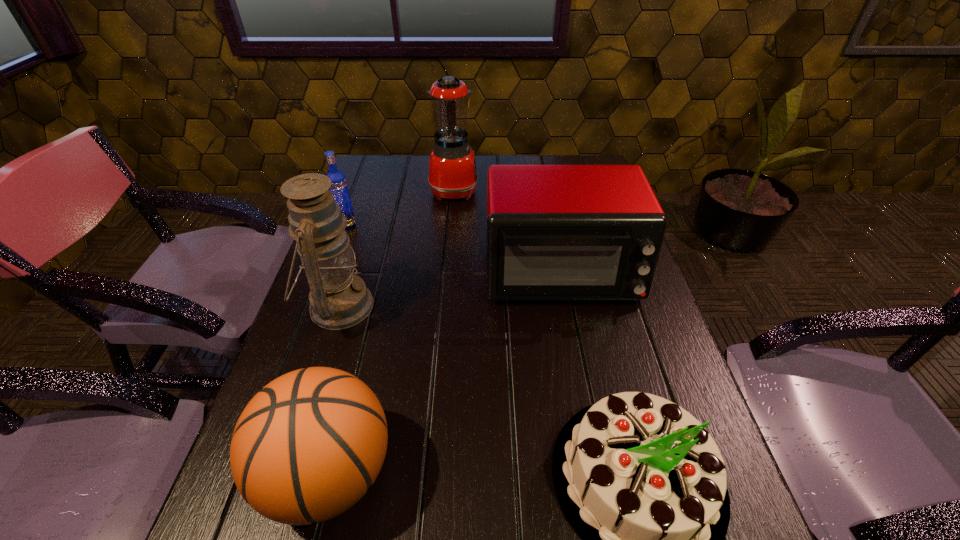
The width and height of the screenshot is (960, 540). Identify the location of vodka that is positioned at the left edge. (339, 188).

At what (x,y) coordinates should I click in order to perform the action: click on object present at the right edge. Please return your answer as a coordinate pair (x, y). Looking at the image, I should click on (554, 232).

This screenshot has height=540, width=960. What are the coordinates of `vacant space at the far edge of the desktop` in the screenshot? It's located at (494, 157).

Locate an element on the screen. free space at the left edge of the desktop is located at coordinates (348, 350).

In the image, there is a desktop. At what (x,y) coordinates should I click in order to perform the action: click on vacant space at the right edge. Please return your answer as a coordinate pair (x, y). Looking at the image, I should click on (631, 352).

This screenshot has width=960, height=540. In order to click on blank region between the oil lamp and the toaster oven in this screenshot , I will do `click(449, 289)`.

Locate an element on the screen. The height and width of the screenshot is (540, 960). free space that is in between the oil lamp and the toaster oven is located at coordinates (449, 289).

Image resolution: width=960 pixels, height=540 pixels. In order to click on unoccupied position between the oil lamp and the food processor in this screenshot , I will do `click(396, 248)`.

The width and height of the screenshot is (960, 540). I want to click on vacant area between the vodka and the toaster oven, so click(453, 248).

Identify which object is the third closest to the toaster oven. Please provide its 2D coordinates. Your answer should be formatted as a tuple, i.e. [(x, y)], where the tuple contains the x and y coordinates of a point satisfying the conditions above.

[(339, 299)]